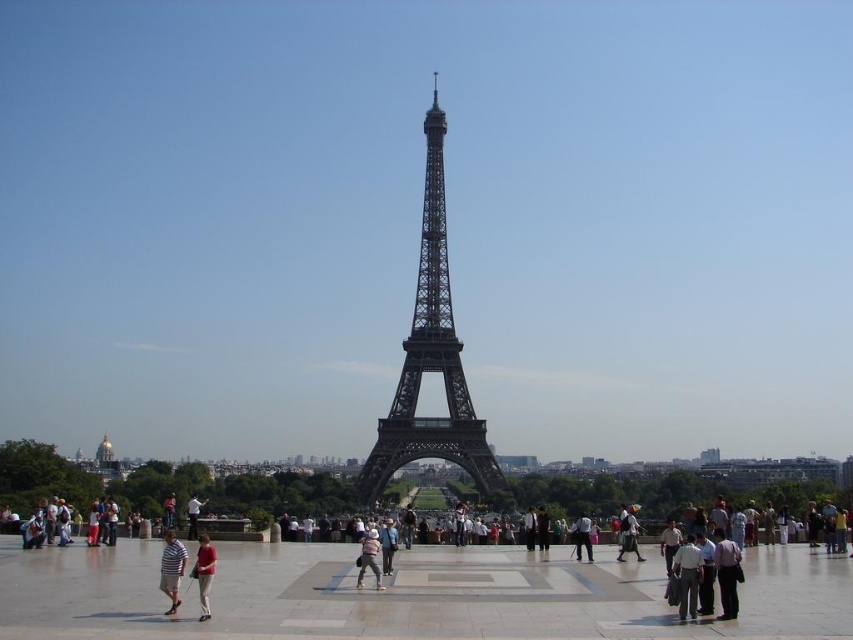
You are a photographer trying to capture the Eiffel Tower in the background with a light beige fabric hat in the foreground. Based on the scene, will the metallic gray eiffel tower at center appear larger than the light beige fabric hat at center in your photo?

Yes, the metallic gray eiffel tower at center is bigger than the light beige fabric hat at center, so it will appear larger in the photo.

You are a photographer standing in front of the Eiffel Tower. You notice a light beige fabric hat at center and a light brown leather jacket at center. Which object is wider from your perspective?

The light beige fabric hat at center might be wider than light brown leather jacket at center.

In the scene shown: You are standing in the plaza in front of the Eiffel Tower. You see the metallic gray eiffel tower at center and the light brown leather bag at center. Which object is closer to you?

The metallic gray eiffel tower at center is closer to you because it is in front of the light brown leather bag at center.